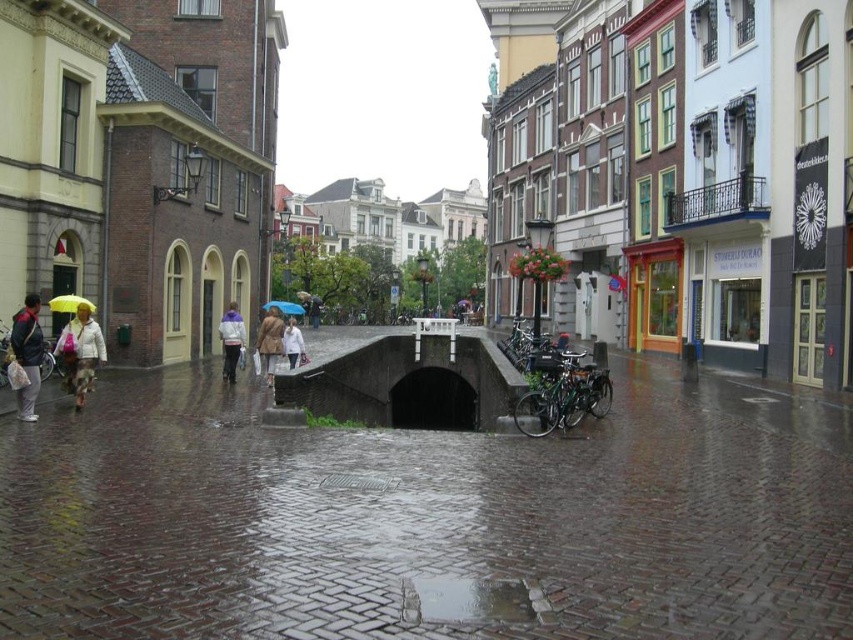
Question: Observing the image, what is the correct spatial positioning of matte gray jacket at left in reference to white cotton jacket at center?

Choices:
 (A) left
 (B) right

Answer: (A)

Question: Which object is closer to the camera taking this photo?

Choices:
 (A) brown leather coat at center
 (B) purple fleece jacket at center
 (C) wet cobblestone pavement at center
 (D) matte gray jacket at left

Answer: (C)

Question: Among these objects, which one is farthest from the camera?

Choices:
 (A) wet cobblestone pavement at center
 (B) matte gray jacket at left

Answer: (B)

Question: Which point is farther to the camera?

Choices:
 (A) blue matte umbrella at center
 (B) purple fleece jacket at center
 (C) matte gray jacket at left
 (D) yellow matte umbrella at left

Answer: (A)

Question: Can you confirm if matte gray jacket at left is positioned below brown leather coat at center?

Choices:
 (A) no
 (B) yes

Answer: (A)

Question: Is white matte jacket at left thinner than purple fleece jacket at center?

Choices:
 (A) no
 (B) yes

Answer: (A)